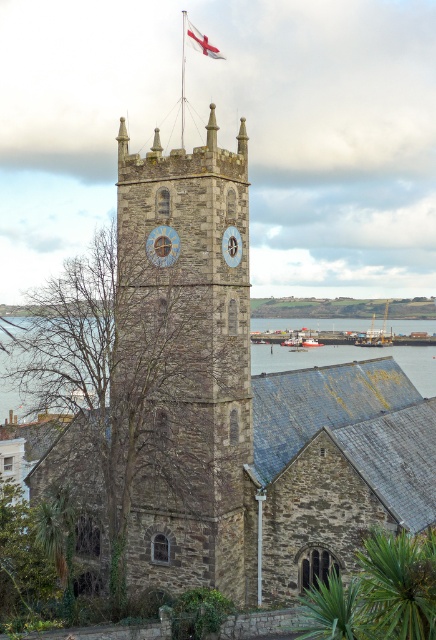
You are standing in front of the historic stone church tower. You see two clocks labeled as the blue painted wood clock at center and the blue stone clock at center. Which one is positioned to the left?

The blue painted wood clock at center is positioned to the left of the blue stone clock at center.

You are a tourist standing in front of the historic stone church tower. You notice the stone clock tower at center and the red fabric flag at upper center. Which object is located to the left of the other?

The stone clock tower at center is positioned on the left side of red fabric flag at upper center, so it is to the left of the flag.

You are standing at the coordinates 0.5, 0.4 in the image. Which direction should you move to get closer to the stone clock tower at center?

The stone clock tower at center is located at point (186, 362). Since you are at (174, 320), you should move northeast to get closer to the stone clock tower at center.